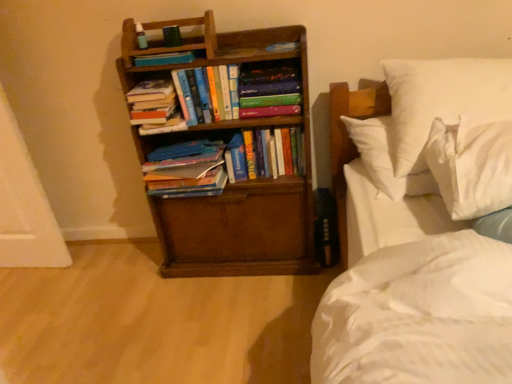
Question: Could you tell me if white soft pillow at upper right, the first pillow in the back-to-front sequence, is turned towards hardcover books at left, the 5th book positioned from the right?

Choices:
 (A) no
 (B) yes

Answer: (A)

Question: Is the surface of white soft pillow at upper right, the 2th pillow from the front, in direct contact with hardcover books at left, the 5th book positioned from the right?

Choices:
 (A) yes
 (B) no

Answer: (B)

Question: Can hardcover books at left, which is the first book from left to right, be found inside white soft pillow at upper right, the 2th pillow from the front?

Choices:
 (A) no
 (B) yes

Answer: (A)

Question: Considering the relative positions of white soft pillow at upper right, the first pillow in the back-to-front sequence, and hardcover books at left, the 5th book positioned from the right, in the image provided, is white soft pillow at upper right, the first pillow in the back-to-front sequence, to the left of hardcover books at left, the 5th book positioned from the right, from the viewer's perspective?

Choices:
 (A) no
 (B) yes

Answer: (A)

Question: From a real-world perspective, is white soft pillow at upper right, the 2th pillow from the front, physically below hardcover books at left, the 5th book positioned from the right?

Choices:
 (A) yes
 (B) no

Answer: (A)

Question: Is point (150, 130) positioned closer to the camera than point (443, 137)?

Choices:
 (A) farther
 (B) closer

Answer: (A)

Question: From the image's perspective, is hardcover books at left, the 5th book positioned from the right, above or below white soft pillow at upper right, the 1th pillow viewed from the front?

Choices:
 (A) above
 (B) below

Answer: (A)

Question: Relative to white soft pillow at upper right, which appears as the second pillow when viewed from the back, is hardcover books at left, the 5th book positioned from the right, in front or behind?

Choices:
 (A) behind
 (B) front

Answer: (A)

Question: In the image, is hardcover books at left, which is the first book from left to right, on the left side or the right side of white soft pillow at upper right, the 1th pillow viewed from the front?

Choices:
 (A) left
 (B) right

Answer: (A)

Question: From a real-world perspective, is brown wooden bookcase at left above or below hardcover books at left, the 5th book positioned from the right?

Choices:
 (A) above
 (B) below

Answer: (B)

Question: From the image's perspective, relative to hardcover books at left, the 5th book positioned from the right, is brown wooden bookcase at left above or below?

Choices:
 (A) above
 (B) below

Answer: (B)

Question: Visually, is brown wooden bookcase at left positioned to the left or to the right of hardcover books at left, the 5th book positioned from the right?

Choices:
 (A) left
 (B) right

Answer: (B)

Question: Is brown wooden bookcase at left wider or thinner than hardcover books at left, the 5th book positioned from the right?

Choices:
 (A) wide
 (B) thin

Answer: (A)

Question: Choose the correct answer: Is white soft pillow at upper right, the first pillow in the back-to-front sequence, inside hardcover book at center, which is the 5th book from left to right, or outside it?

Choices:
 (A) outside
 (B) inside

Answer: (A)

Question: Is point (406, 96) closer or farther from the camera than point (294, 109)?

Choices:
 (A) closer
 (B) farther

Answer: (A)